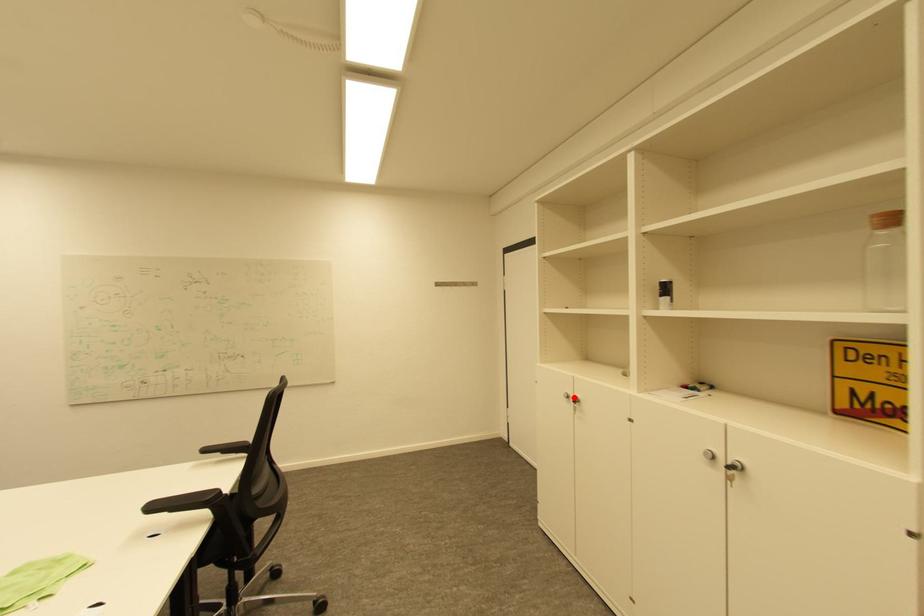
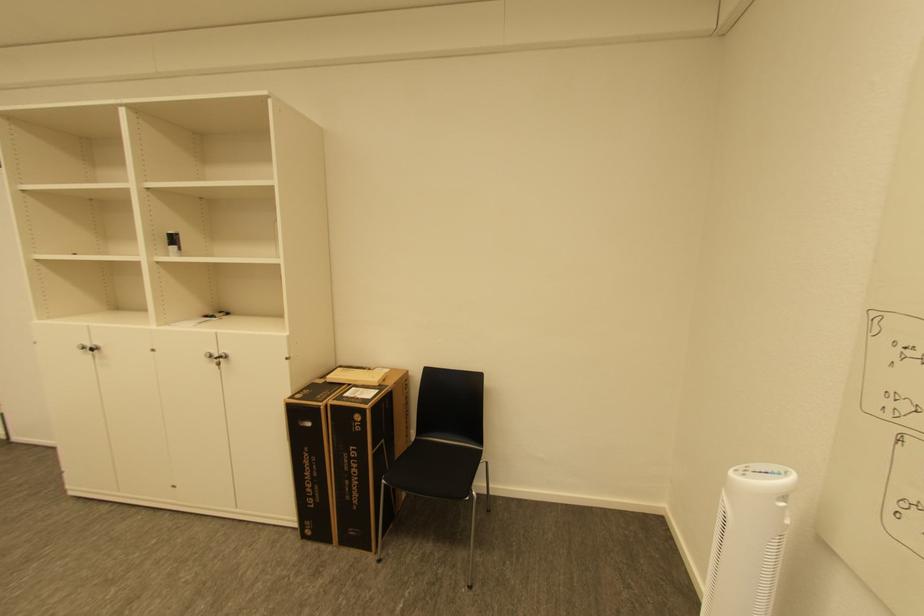
Where in the second image is the point corresponding to the highlighted location from the first image?

(91, 347)